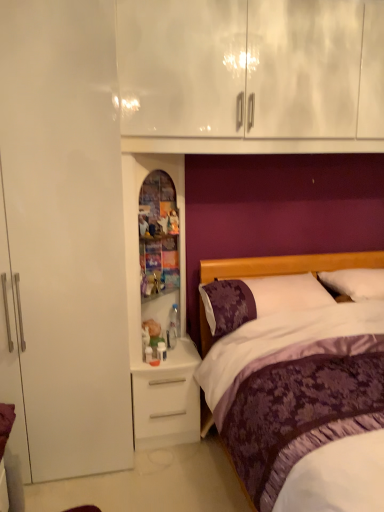
Question: Does purple floral pillow at right, which appears as the second pillow when viewed from the right, lie behind white glossy medicine cabinet at center?

Choices:
 (A) yes
 (B) no

Answer: (A)

Question: From the image's perspective, is purple floral pillow at right, which appears as the second pillow when viewed from the right, over white glossy medicine cabinet at center?

Choices:
 (A) yes
 (B) no

Answer: (B)

Question: Is purple floral pillow at right, the 1th pillow in the left-to-right sequence, completely or partially outside of white glossy medicine cabinet at center?

Choices:
 (A) yes
 (B) no

Answer: (A)

Question: Is purple floral pillow at right, which appears as the second pillow when viewed from the right, bigger than white glossy medicine cabinet at center?

Choices:
 (A) yes
 (B) no

Answer: (B)

Question: From a real-world perspective, is purple floral pillow at right, which appears as the second pillow when viewed from the right, beneath white glossy medicine cabinet at center?

Choices:
 (A) no
 (B) yes

Answer: (B)

Question: Are purple floral pillow at right, the 1th pillow in the left-to-right sequence, and white glossy medicine cabinet at center beside each other?

Choices:
 (A) no
 (B) yes

Answer: (A)

Question: From the image's perspective, is purple satin pillow at right, which appears as the 2th pillow when viewed from the left, on top of white glossy medicine cabinet at center?

Choices:
 (A) yes
 (B) no

Answer: (B)

Question: Is purple satin pillow at right, the first pillow when ordered from right to left, surrounding white glossy medicine cabinet at center?

Choices:
 (A) no
 (B) yes

Answer: (A)

Question: Is purple satin pillow at right, the first pillow when ordered from right to left, positioned with its back to white glossy medicine cabinet at center?

Choices:
 (A) yes
 (B) no

Answer: (B)

Question: Can you confirm if purple satin pillow at right, the first pillow when ordered from right to left, is positioned to the left of white glossy medicine cabinet at center?

Choices:
 (A) no
 (B) yes

Answer: (A)

Question: Is purple satin pillow at right, the first pillow when ordered from right to left, at the right side of white glossy medicine cabinet at center?

Choices:
 (A) no
 (B) yes

Answer: (B)

Question: Does purple satin pillow at right, which appears as the 2th pillow when viewed from the left, lie in front of white glossy medicine cabinet at center?

Choices:
 (A) yes
 (B) no

Answer: (B)

Question: From a real-world perspective, is white matte desk at lower center positioned over purple satin bed at center based on gravity?

Choices:
 (A) no
 (B) yes

Answer: (A)